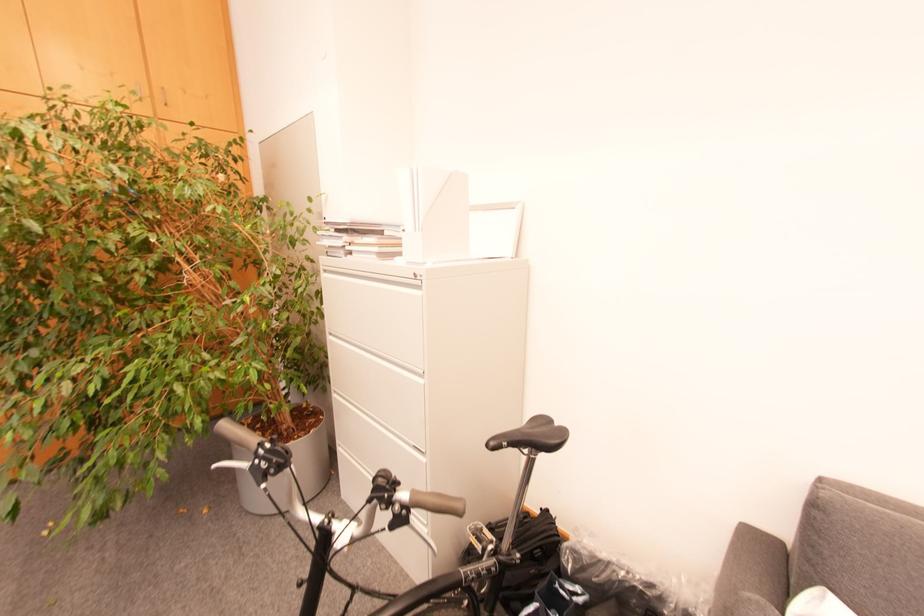
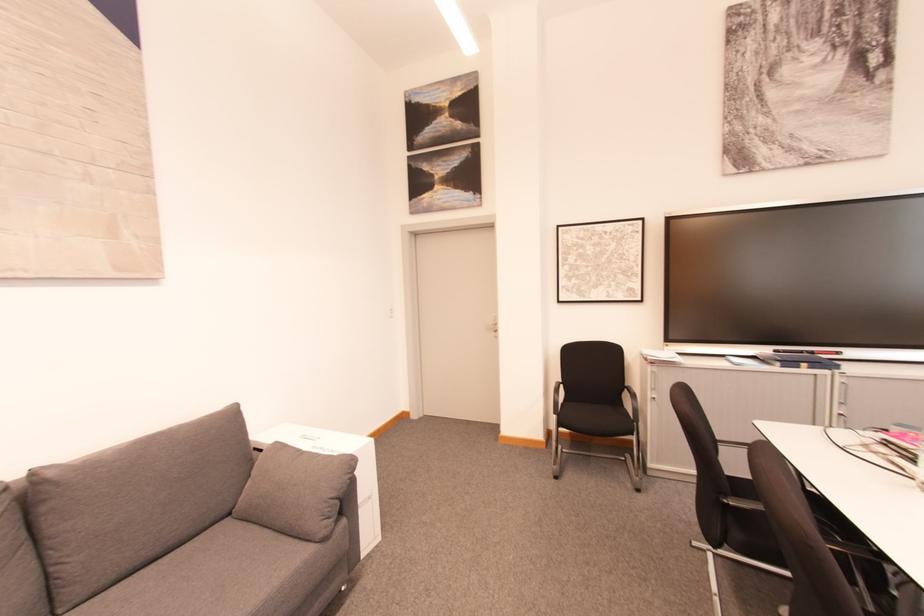
Question: The images are taken continuously from a first-person perspective. In which direction is your viewpoint rotating?

Choices:
 (A) Left
 (B) Right
 (C) Up
 (D) Down

Answer: (B)